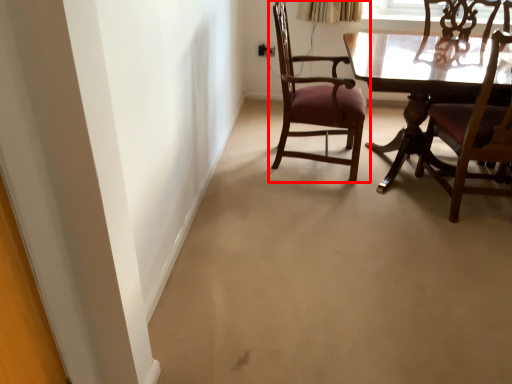
Question: From the image's perspective, what is the correct spatial positioning of chair (annotated by the red box) in reference to chair?

Choices:
 (A) below
 (B) above

Answer: (B)